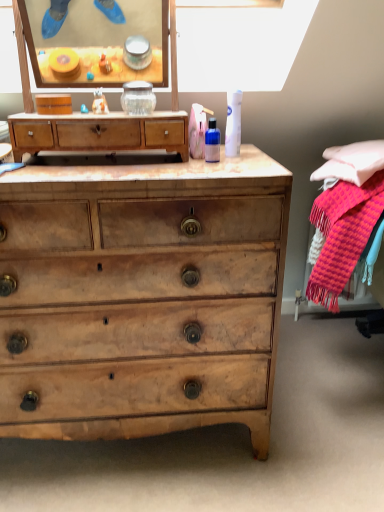
Question: From the image's perspective, relative to light brown wooden chest of drawers at center, the second chest of drawers in the bottom-to-top sequence, is light brown wood chest of drawers at center, which is the first chest of drawers in bottom-to-top order, above or below?

Choices:
 (A) below
 (B) above

Answer: (A)

Question: In the image, is light brown wood chest of drawers at center, which is the first chest of drawers in bottom-to-top order, on the left side or the right side of light brown wooden chest of drawers at center, which ranks as the first chest of drawers in top-to-bottom order?

Choices:
 (A) left
 (B) right

Answer: (A)

Question: Based on their relative distances, which object is farther from the light brown wooden chest of drawers at center, which ranks as the first chest of drawers in top-to-bottom order?

Choices:
 (A) light brown wood chest of drawers at center, acting as the 2th chest of drawers starting from the top
 (B) translucent plastic bottle at center, which is counted as the second toiletry, starting from the right
 (C) white matte canister at upper center, positioned as the 2th toiletry in left-to-right order

Answer: (A)

Question: Based on their relative distances, which object is farther from the light brown wooden chest of drawers at center, the second chest of drawers in the bottom-to-top sequence?

Choices:
 (A) translucent plastic bottle at center, which is counted as the second toiletry, starting from the right
 (B) light brown wood chest of drawers at center, acting as the 2th chest of drawers starting from the top
 (C) white matte canister at upper center, positioned as the 2th toiletry in left-to-right order

Answer: (B)